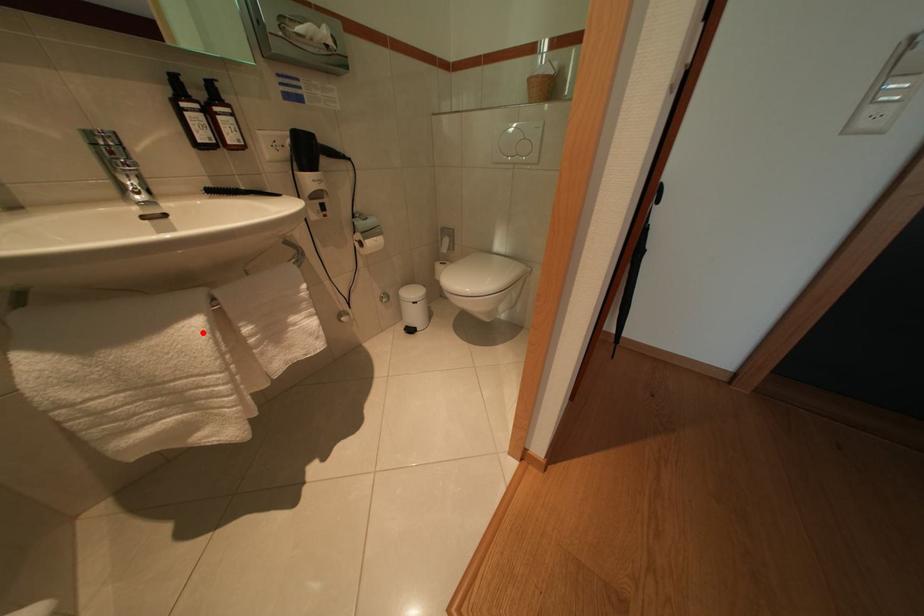
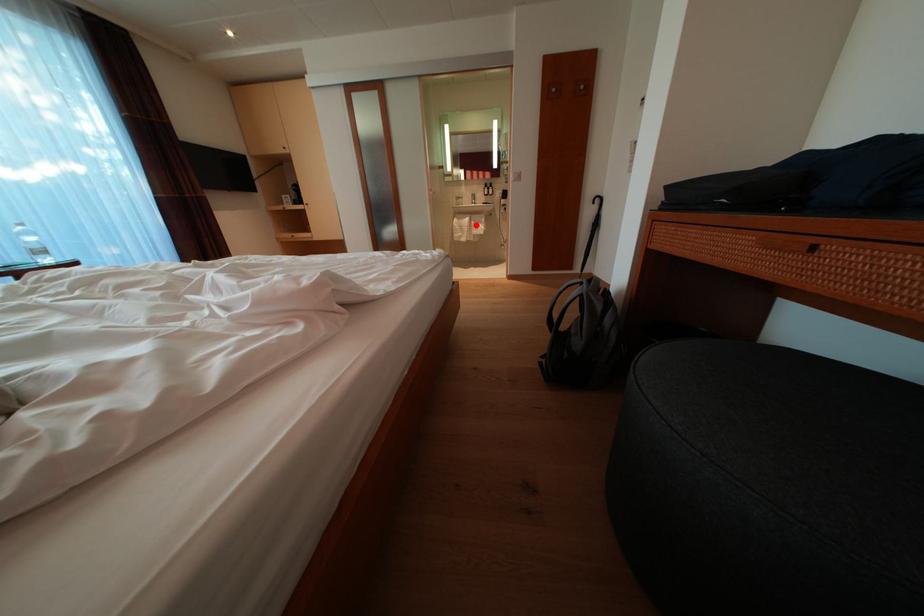
I am providing you with two images of the same scene from different viewpoints. A red point is marked on the first image and another point is marked on the second image. Are the points marked in image1 and image2 representing the same 3D position?

Yes